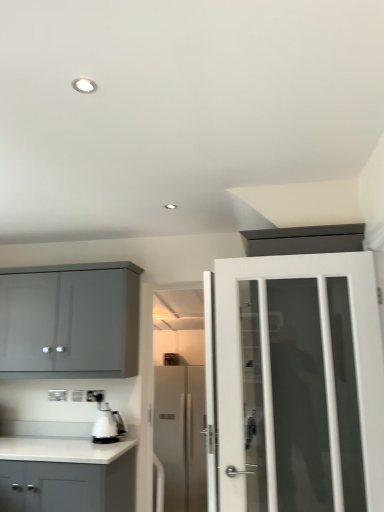
Question: Is white glass door at right, the second door when ordered from back to front, not within white matte cabinet at lower left, which appears as the first cabinetry when ordered from the bottom?

Choices:
 (A) yes
 (B) no

Answer: (A)

Question: Is white matte cabinet at lower left, which appears as the first cabinetry when ordered from the bottom, at the back of white glass door at right, acting as the 1th door starting from the front?

Choices:
 (A) no
 (B) yes

Answer: (A)

Question: Is white glass door at right, the 2th door when ordered from bottom to top, facing towards white matte cabinet at lower left, which appears as the first cabinetry when ordered from the bottom?

Choices:
 (A) no
 (B) yes

Answer: (A)

Question: Is white glass door at right, acting as the 1th door starting from the front, wider than white matte cabinet at lower left, the second cabinetry when ordered from top to bottom?

Choices:
 (A) no
 (B) yes

Answer: (A)

Question: Are white glass door at right, which is the 1th door in top-to-bottom order, and white matte cabinet at lower left, which appears as the first cabinetry when ordered from the bottom, located far from each other?

Choices:
 (A) no
 (B) yes

Answer: (B)

Question: Considering the relative sizes of white glass door at right, which is the 1th door in top-to-bottom order, and white matte cabinet at lower left, the second cabinetry when ordered from top to bottom, in the image provided, is white glass door at right, which is the 1th door in top-to-bottom order, shorter than white matte cabinet at lower left, the second cabinetry when ordered from top to bottom,?

Choices:
 (A) no
 (B) yes

Answer: (A)

Question: Is the surface of white glass door at right, which is the 1th door in top-to-bottom order, in direct contact with white plastic electric outlet at lower center?

Choices:
 (A) no
 (B) yes

Answer: (A)

Question: Is white glass door at right, the 2th door when ordered from bottom to top, located outside white plastic electric outlet at lower center?

Choices:
 (A) no
 (B) yes

Answer: (B)

Question: Is white glass door at right, the second door when ordered from back to front, positioned in front of white plastic electric outlet at lower center?

Choices:
 (A) no
 (B) yes

Answer: (B)

Question: Is white glass door at right, which is the 1th door in top-to-bottom order, oriented towards white plastic electric outlet at lower center?

Choices:
 (A) yes
 (B) no

Answer: (B)

Question: Is white plastic electric outlet at lower center a part of white glass door at right, the second door when ordered from back to front?

Choices:
 (A) no
 (B) yes

Answer: (A)

Question: From the image's perspective, is white glossy coffee machine at lower left over white glass door at right, the second door when ordered from back to front?

Choices:
 (A) yes
 (B) no

Answer: (B)